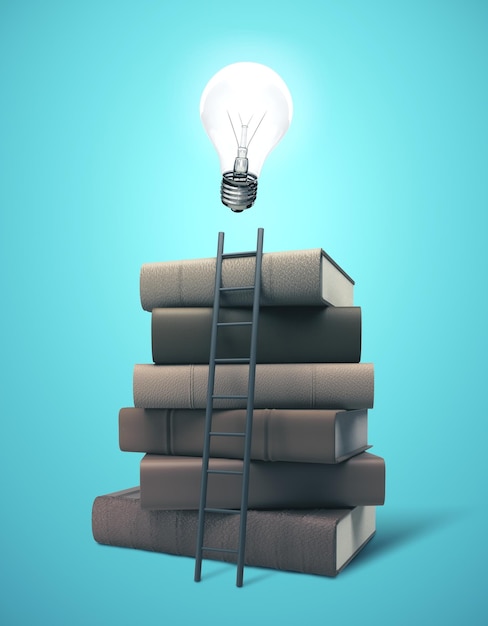
The height and width of the screenshot is (626, 488). I want to click on book, so click(119, 513), click(169, 480), click(162, 427), click(166, 390), click(173, 342), click(171, 268).